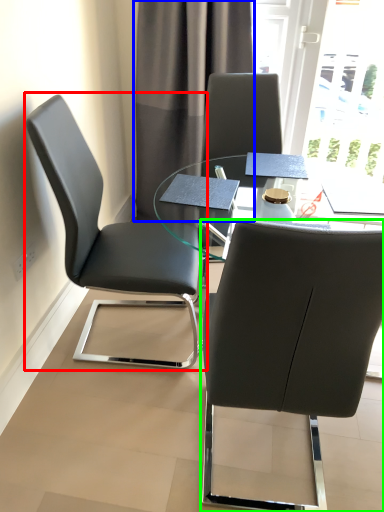
Question: Which is farther away from chair (highlighted by a red box)? curtain (highlighted by a blue box) or chair (highlighted by a green box)?

Choices:
 (A) curtain
 (B) chair

Answer: (A)